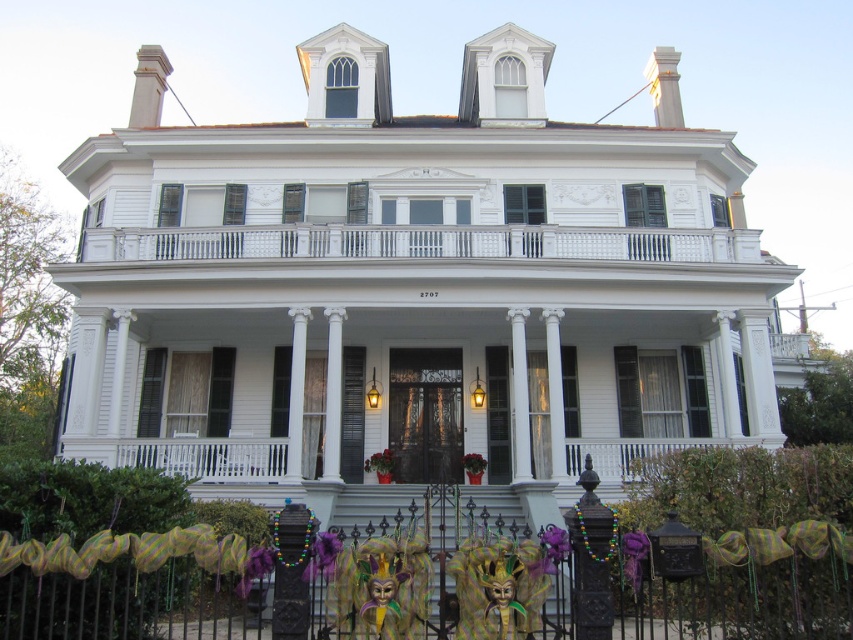
You are standing on the front lawn of the house and want to place a decorative planter between the metallic wrought iron at lower center and the white painted wood railing at upper center. Which object should the planter be placed closer to in order to be visible from the front door?

The metallic wrought iron at lower center is in front of the white painted wood railing at upper center, so placing the decorative planter closer to the metallic wrought iron at lower center will make it more visible from the front door.

You are a delivery person standing at the front door of the house. You need to place a package on the metallic wrought iron at lower center and then move it to the white painted wood railing at upper center. Can you do this without moving the package more than 15 meters?

The metallic wrought iron at lower center and white painted wood railing at upper center are 14.03 meters apart from each other. Since 14.03 meters is less than 15 meters, you can move the package between them without exceeding the 15 meter limit.

You are a photographer standing at the base of the grand house. You want to take a closeup shot of the metallic wrought iron at lower center. Given that your camera can focus on objects within 10 meters, will you need to move closer or further away to capture it?

The metallic wrought iron at lower center is 12.64 meters from the camera. Since the camera can focus within 10 meters, you need to move closer to reduce the distance to within the focus range.